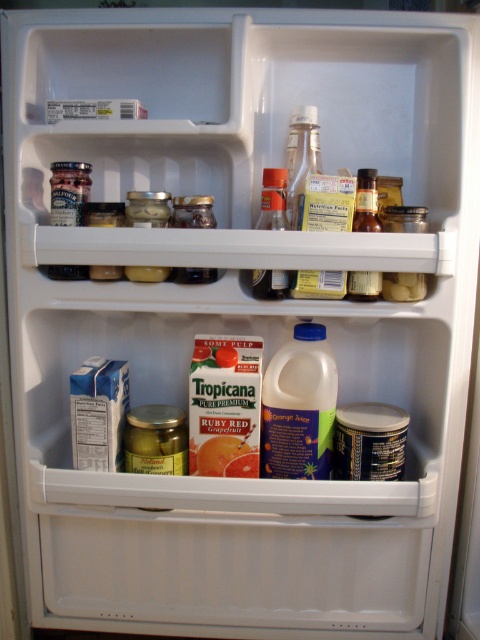
You are organizing the fridge and need to place a new bottle that is 5 inches long. You see the translucent plastic bottle at center and the translucent glass bottle at upper center. Can you fit the new bottle between them?

The distance between the translucent plastic bottle at center and the translucent glass bottle at upper center is 4.00 inches. Since the new bottle is 5 inches long, it cannot fit in the space between them.

You are organizing the fridge and need to access the translucent glass bottle at upper center. However, there is a translucent plastic bottle at center blocking it. Can you move the plastic bottle to reach the glass one?

Yes, the translucent plastic bottle at center is in front of the translucent glass bottle at upper center, so moving it would allow access.

You are trying to fit a new 4.5 inch wide container between the matte glass jar at upper left and the translucent plastic bottle at center in your fridge. Can you fit it there?

The distance between the matte glass jar at upper left and the translucent plastic bottle at center is 9.77 inches. Since the container is 4.5 inches wide, there is enough space to fit it between them.